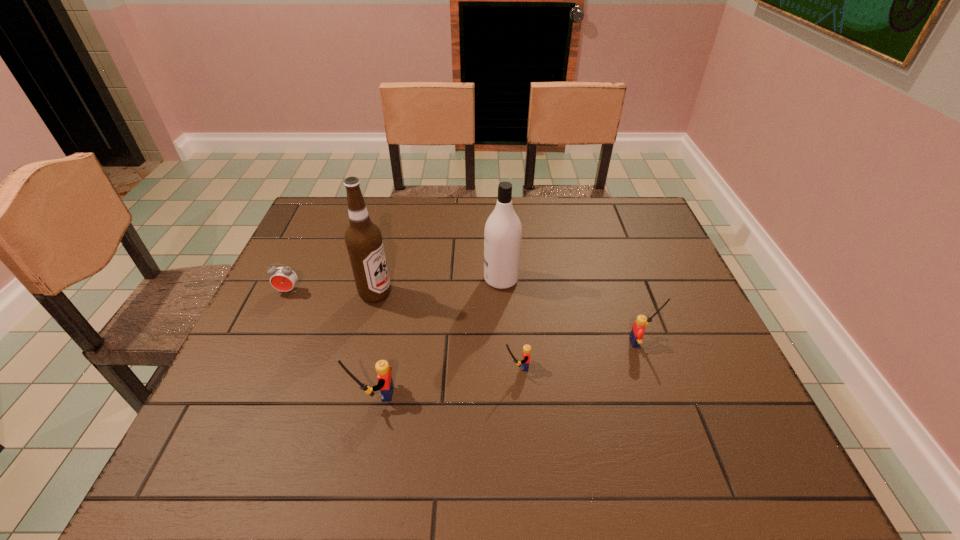
Observe the arrangement of all Legos in the image. To keep them evenly spaced, where would you place another Lego on the left? Please locate a free space. Please provide its 2D coordinates. Your answer should be formatted as a tuple, i.e. [(x, y)], where the tuple contains the x and y coordinates of a point satisfying the conditions above.

[(216, 425)]